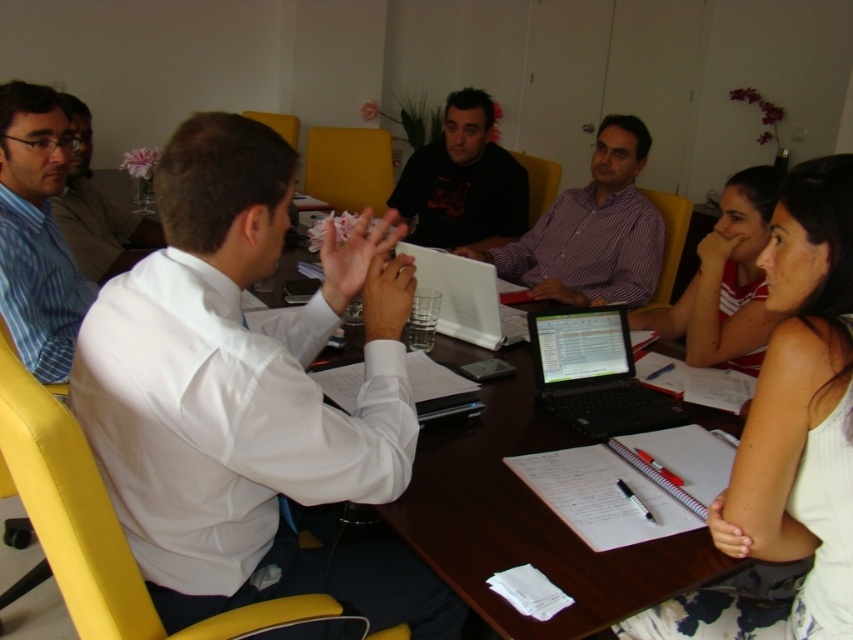
Is white fabric shirt at upper right below black matte shirt at center?

Indeed, white fabric shirt at upper right is positioned under black matte shirt at center.

Who is more distant from viewer, [805,484] or [500,227]?

The point [500,227] is more distant.

The image size is (853, 640). In order to click on white fabric shirt at upper right in this screenshot , I will do `click(788, 436)`.

Can you confirm if white fabric shirt at upper right is shorter than black glossy laptop at center?

In fact, white fabric shirt at upper right may be taller than black glossy laptop at center.

Does white fabric shirt at upper right lie behind black glossy laptop at center?

No.

Locate an element on the screen. The width and height of the screenshot is (853, 640). white fabric shirt at upper right is located at coordinates (788, 436).

In the scene shown: Which is more to the right, white fabric shirt at upper right or blue striped shirt at left?

white fabric shirt at upper right

Does white fabric shirt at upper right have a greater height compared to blue striped shirt at left?

Correct, white fabric shirt at upper right is much taller as blue striped shirt at left.

Who is more distant from viewer, (671, 608) or (44, 262)?

The point (44, 262) is behind.

Locate an element on the screen. white fabric shirt at upper right is located at coordinates (788, 436).